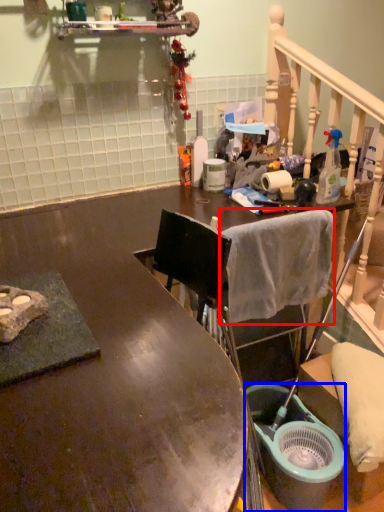
Question: Which object is closer to the camera taking this photo, bath towel (highlighted by a red box) or bucket (highlighted by a blue box)?

Choices:
 (A) bath towel
 (B) bucket

Answer: (A)